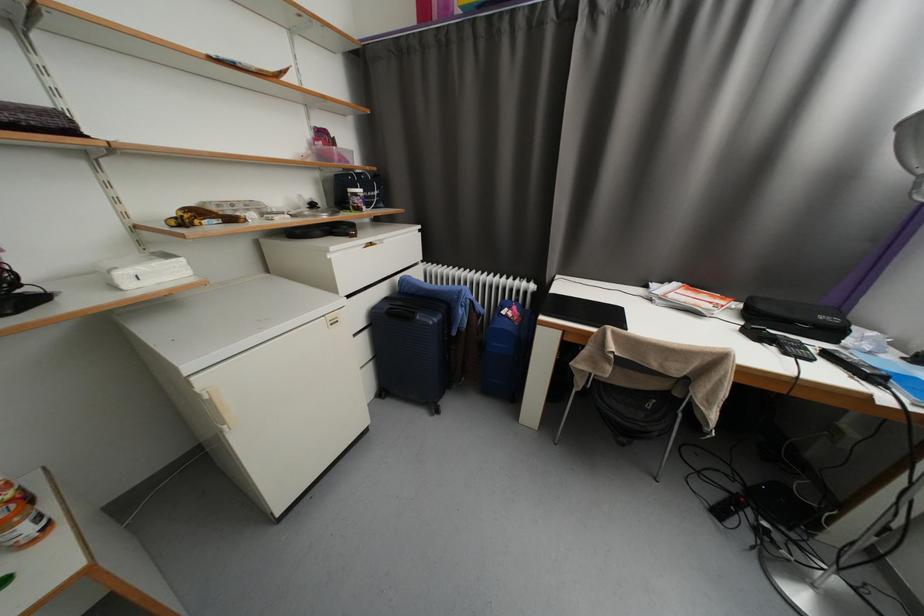
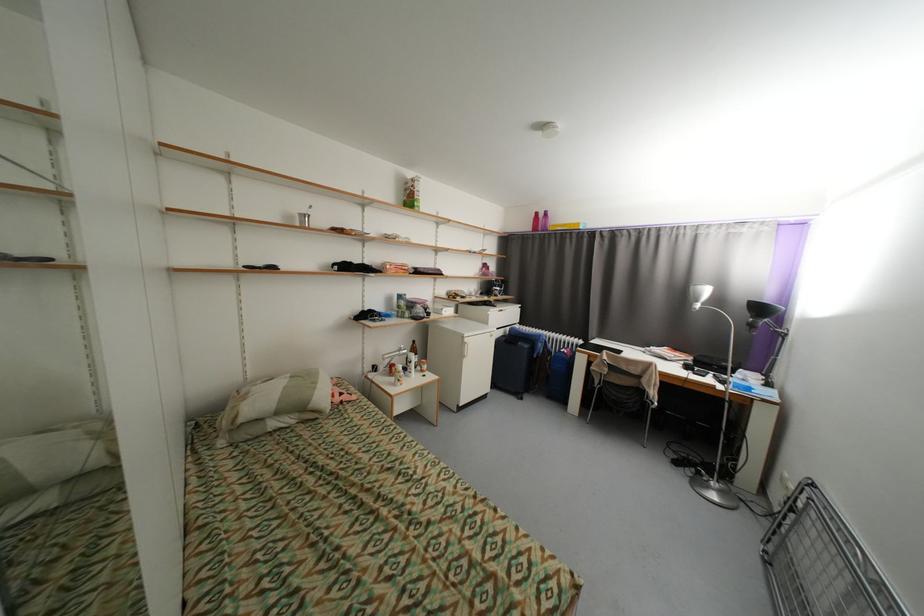
Where in the second image is the point corresponding to point 208,383 from the first image?

(472, 341)